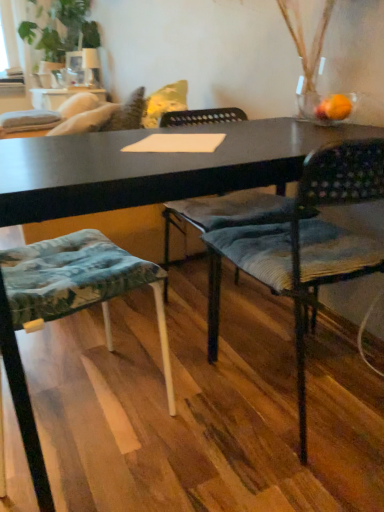
Question: From the image's perspective, is green leafy plant at upper left under textured fabric chair at center, the 2th chair positioned from the left?

Choices:
 (A) no
 (B) yes

Answer: (A)

Question: Considering the relative positions of green leafy plant at upper left and textured fabric chair at center, placed as the first chair when sorted from right to left, in the image provided, is green leafy plant at upper left in front of textured fabric chair at center, placed as the first chair when sorted from right to left,?

Choices:
 (A) yes
 (B) no

Answer: (B)

Question: Is green leafy plant at upper left oriented away from textured fabric chair at center, the 2th chair positioned from the left?

Choices:
 (A) no
 (B) yes

Answer: (A)

Question: Considering the relative sizes of green leafy plant at upper left and textured fabric chair at center, placed as the first chair when sorted from right to left, in the image provided, is green leafy plant at upper left smaller than textured fabric chair at center, placed as the first chair when sorted from right to left,?

Choices:
 (A) yes
 (B) no

Answer: (B)

Question: From the image's perspective, is green leafy plant at upper left above textured fabric chair at center, the 2th chair positioned from the left?

Choices:
 (A) no
 (B) yes

Answer: (B)

Question: From the image's perspective, relative to textured fabric chair at center, the 2th chair positioned from the left, is green leafy plant at upper left above or below?

Choices:
 (A) above
 (B) below

Answer: (A)

Question: Considering the positions of green leafy plant at upper left and textured fabric chair at center, the 2th chair positioned from the left, in the image, is green leafy plant at upper left taller or shorter than textured fabric chair at center, the 2th chair positioned from the left,?

Choices:
 (A) tall
 (B) short

Answer: (A)

Question: Is green leafy plant at upper left to the left or to the right of textured fabric chair at center, the 2th chair positioned from the left, in the image?

Choices:
 (A) right
 (B) left

Answer: (B)

Question: In terms of size, does green leafy plant at upper left appear bigger or smaller than textured fabric chair at center, the 2th chair positioned from the left?

Choices:
 (A) small
 (B) big

Answer: (B)

Question: Considering their positions, is textured fabric cushion at lower left, which is the 1th chair from left to right, located in front of or behind green leafy plant at upper left?

Choices:
 (A) front
 (B) behind

Answer: (A)

Question: Is textured fabric cushion at lower left, the 2th chair viewed from the right, inside the boundaries of green leafy plant at upper left, or outside?

Choices:
 (A) outside
 (B) inside

Answer: (A)

Question: Based on their positions, is textured fabric cushion at lower left, the 2th chair viewed from the right, located to the left or right of green leafy plant at upper left?

Choices:
 (A) right
 (B) left

Answer: (A)

Question: Is textured fabric cushion at lower left, the 2th chair viewed from the right, taller or shorter than green leafy plant at upper left?

Choices:
 (A) tall
 (B) short

Answer: (B)

Question: Considering the positions of green leafy plant at upper left and textured fabric cushion at lower left, the 2th chair viewed from the right, in the image, is green leafy plant at upper left wider or thinner than textured fabric cushion at lower left, the 2th chair viewed from the right,?

Choices:
 (A) wide
 (B) thin

Answer: (A)

Question: Considering the relative positions of green leafy plant at upper left and textured fabric cushion at lower left, the 2th chair viewed from the right, in the image provided, is green leafy plant at upper left to the left or to the right of textured fabric cushion at lower left, the 2th chair viewed from the right,?

Choices:
 (A) left
 (B) right

Answer: (A)